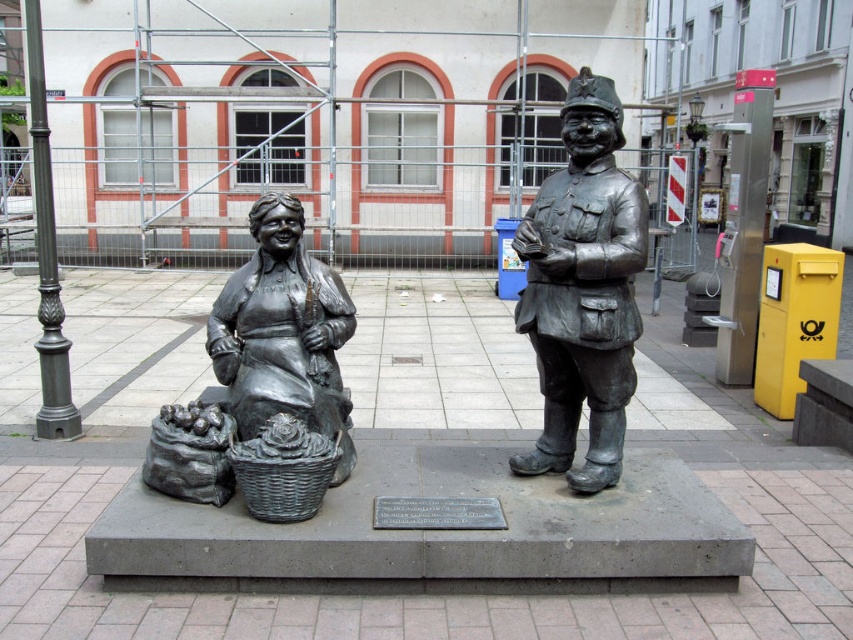
You are an urban planner assessing the spacing between two bronze statues in a plaza. The statues are the bronze statue at center and the bronze statue at left. Based on their widths, which statue requires more space to accommodate its width?

The bronze statue at left requires more space to accommodate its width since it has a greater width than the bronze statue at center.

You are standing in the plaza and want to take a photo of both statues. You notice two specific points marked on the statues. The first point is at coordinates point (144, 476) and the second at point (264, 486). Which of these points is closer to you?

The point at coordinates point (144, 476) is closer to you because it is further to the viewer than point (264, 486).

You are a tour guide explaining the statues in the plaza. You want to mention the location of the bronze statue at center relative to the rustic wicker basket at lower center. How would you describe its position?

The bronze statue at center is positioned on the right side of rustic wicker basket at lower center.